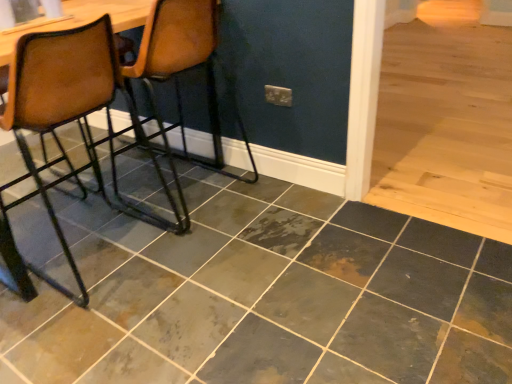
The image size is (512, 384). Describe the element at coordinates (266, 296) in the screenshot. I see `marbled slate tile at center` at that location.

Measure the distance between marbled slate tile at center and camera.

They are 1.28 meters apart.

Locate an element on the screen. The image size is (512, 384). brown leather chair at left, which is counted as the 1th chair, starting from the left is located at coordinates (76, 119).

Measure the distance between brown leather chair at left, arranged as the 2th chair when viewed from the right, and camera.

brown leather chair at left, arranged as the 2th chair when viewed from the right, is 5.35 feet away from camera.

This screenshot has height=384, width=512. In order to click on brown leather chair at left, which is counted as the 2th chair, starting from the left in this screenshot , I will do `click(167, 79)`.

Locate an element on the screen. marbled slate tile at center is located at coordinates (266, 296).

Is marbled slate tile at center positioned far away from brown leather chair at left, which is counted as the 1th chair, starting from the left?

Actually, marbled slate tile at center and brown leather chair at left, which is counted as the 1th chair, starting from the left, are a little close together.

Based on the photo, from the image's perspective, is marbled slate tile at center positioned above or below brown leather chair at left, which is counted as the 1th chair, starting from the left?

marbled slate tile at center is situated lower than brown leather chair at left, which is counted as the 1th chair, starting from the left, in the image.

Can you confirm if marbled slate tile at center is thinner than brown leather chair at left, which is counted as the 1th chair, starting from the left?

No, marbled slate tile at center is not thinner than brown leather chair at left, which is counted as the 1th chair, starting from the left.

From a real-world perspective, is marbled slate tile at center below brown leather chair at left, which is counted as the 1th chair, starting from the left?

Yes, from a real-world perspective, marbled slate tile at center is beneath brown leather chair at left, which is counted as the 1th chair, starting from the left.

Can you confirm if brown leather chair at left, which is counted as the 1th chair, starting from the left, is shorter than marbled slate tile at center?

No, brown leather chair at left, which is counted as the 1th chair, starting from the left, is not shorter than marbled slate tile at center.

Is the depth of brown leather chair at left, which is counted as the 1th chair, starting from the left, greater than that of marbled slate tile at center?

Yes, it is behind marbled slate tile at center.

From the picture: Are brown leather chair at left, the first chair from the right, and marbled slate tile at center far apart?

No.

Looking at this image, which object is closer to the camera taking this photo, brown leather chair at left, the first chair from the right, or marbled slate tile at center?

marbled slate tile at center is more forward.

Would you say brown leather chair at left, the first chair from the right, is inside or outside marbled slate tile at center?

brown leather chair at left, the first chair from the right, is spatially situated outside marbled slate tile at center.

Between brown leather chair at left, the first chair from the right, and marbled slate tile at center, which one appears on the right side from the viewer's perspective?

marbled slate tile at center.

From a real-world perspective, is brown leather chair at left, the first chair from the right, located beneath brown leather chair at left, which is counted as the 1th chair, starting from the left?

No, from a real-world perspective, brown leather chair at left, the first chair from the right, is not beneath brown leather chair at left, which is counted as the 1th chair, starting from the left.

Is brown leather chair at left, the first chair from the right, positioned in front of brown leather chair at left, arranged as the 2th chair when viewed from the right?

No, it is behind brown leather chair at left, arranged as the 2th chair when viewed from the right.

From the image's perspective, is brown leather chair at left, the first chair from the right, above brown leather chair at left, arranged as the 2th chair when viewed from the right?

Yes, from the image's perspective, brown leather chair at left, the first chair from the right, is over brown leather chair at left, arranged as the 2th chair when viewed from the right.

Can you tell me how much brown leather chair at left, the first chair from the right, and brown leather chair at left, which is counted as the 1th chair, starting from the left, differ in facing direction?

The angular difference between brown leather chair at left, the first chair from the right, and brown leather chair at left, which is counted as the 1th chair, starting from the left, is 2.25 degrees.

Is brown leather chair at left, which is counted as the 1th chair, starting from the left, far from brown leather chair at left, which is counted as the 2th chair, starting from the left?

No.

Is the depth of brown leather chair at left, arranged as the 2th chair when viewed from the right, less than that of brown leather chair at left, the first chair from the right?

Yes, brown leather chair at left, arranged as the 2th chair when viewed from the right, is closer to the viewer.

Which object is positioned more to the right, brown leather chair at left, arranged as the 2th chair when viewed from the right, or brown leather chair at left, which is counted as the 2th chair, starting from the left?

brown leather chair at left, which is counted as the 2th chair, starting from the left, is more to the right.

How different are the orientations of brown leather chair at left, arranged as the 2th chair when viewed from the right, and brown leather chair at left, the first chair from the right, in degrees?

The facing directions of brown leather chair at left, arranged as the 2th chair when viewed from the right, and brown leather chair at left, the first chair from the right, are 2.25 degrees apart.

From the image's perspective, relative to brown leather chair at left, the first chair from the right, is marbled slate tile at center above or below?

marbled slate tile at center is situated lower than brown leather chair at left, the first chair from the right, in the image.

Is marbled slate tile at center positioned far away from brown leather chair at left, which is counted as the 2th chair, starting from the left?

marbled slate tile at center is actually quite close to brown leather chair at left, which is counted as the 2th chair, starting from the left.

From a real-world perspective, relative to brown leather chair at left, the first chair from the right, is marbled slate tile at center vertically above or below?

In terms of real-world spatial position, marbled slate tile at center is below brown leather chair at left, the first chair from the right.

At what (x,y) coordinates should I click in order to perform the action: click on the 2nd chair counting from the left of the marbled slate tile at center. Please return your answer as a coordinate pair (x, y). Looking at the image, I should click on point(76,119).

This screenshot has width=512, height=384. I want to click on ceramic tile on the right of brown leather chair at left, arranged as the 2th chair when viewed from the right, so click(x=266, y=296).

When comparing their distances from marbled slate tile at center, does brown leather chair at left, the first chair from the right, or brown leather chair at left, which is counted as the 1th chair, starting from the left, seem closer?

Based on the image, brown leather chair at left, which is counted as the 1th chair, starting from the left, appears to be nearer to marbled slate tile at center.

Based on their spatial positions, is marbled slate tile at center or brown leather chair at left, the first chair from the right, further from brown leather chair at left, arranged as the 2th chair when viewed from the right?

brown leather chair at left, the first chair from the right, is further to brown leather chair at left, arranged as the 2th chair when viewed from the right.

Which object lies nearer to the anchor point brown leather chair at left, which is counted as the 2th chair, starting from the left, marbled slate tile at center or brown leather chair at left, arranged as the 2th chair when viewed from the right?

Based on the image, brown leather chair at left, arranged as the 2th chair when viewed from the right, appears to be nearer to brown leather chair at left, which is counted as the 2th chair, starting from the left.

Looking at this image, based on their spatial positions, is brown leather chair at left, which is counted as the 2th chair, starting from the left, or marbled slate tile at center closer to brown leather chair at left, arranged as the 2th chair when viewed from the right?

The object closer to brown leather chair at left, arranged as the 2th chair when viewed from the right, is marbled slate tile at center.

From the image, which object appears to be farther from brown leather chair at left, which is counted as the 2th chair, starting from the left, brown leather chair at left, arranged as the 2th chair when viewed from the right, or marbled slate tile at center?

marbled slate tile at center is further to brown leather chair at left, which is counted as the 2th chair, starting from the left.

Looking at the image, which one is located closer to marbled slate tile at center, brown leather chair at left, arranged as the 2th chair when viewed from the right, or brown leather chair at left, the first chair from the right?

brown leather chair at left, arranged as the 2th chair when viewed from the right, is positioned closer to the anchor marbled slate tile at center.

Find the location of `chair between brown leather chair at left, which is counted as the 2th chair, starting from the left, and marbled slate tile at center from top to bottom`. chair between brown leather chair at left, which is counted as the 2th chair, starting from the left, and marbled slate tile at center from top to bottom is located at coordinates (76, 119).